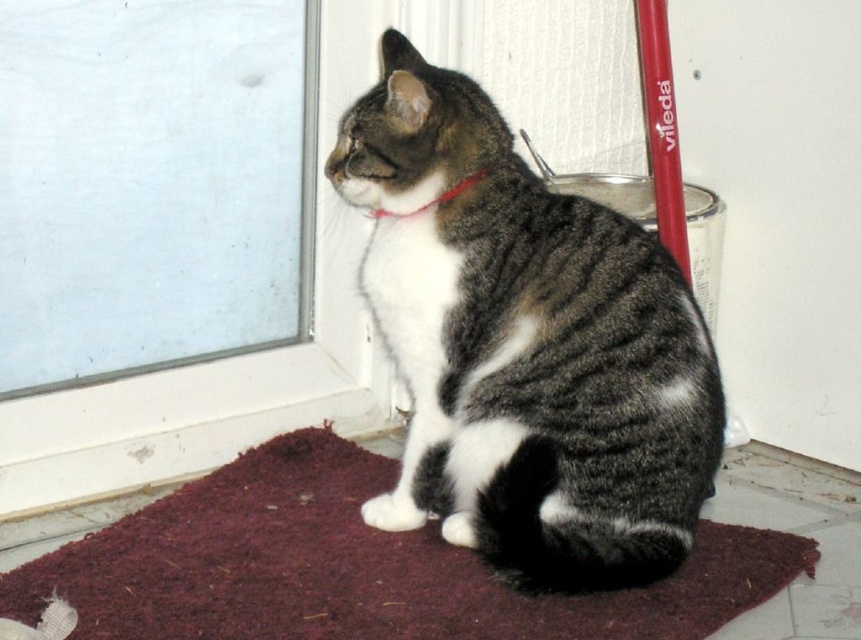
From the picture: Is tabby fur cat at center shorter than red fabric collar at center?

In fact, tabby fur cat at center may be taller than red fabric collar at center.

Is tabby fur cat at center wider than red fabric collar at center?

Yes, tabby fur cat at center is wider than red fabric collar at center.

Is point (546, 321) closer to camera compared to point (385, 211)?

That is True.

The height and width of the screenshot is (640, 861). I want to click on tabby fur cat at center, so click(525, 346).

Between tabby fur cat at center and burgundy carpet at lower center, which one has less height?

With less height is burgundy carpet at lower center.

Who is positioned more to the right, tabby fur cat at center or burgundy carpet at lower center?

tabby fur cat at center is more to the right.

Where is `tabby fur cat at center`? The width and height of the screenshot is (861, 640). tabby fur cat at center is located at coordinates (525, 346).

From the picture: Can you confirm if tabby fur cat at center is smaller than transparent glass door at upper left?

No.

Between point (481, 250) and point (84, 369), which one is positioned behind?

Positioned behind is point (84, 369).

Where is `tabby fur cat at center`? This screenshot has width=861, height=640. tabby fur cat at center is located at coordinates (525, 346).